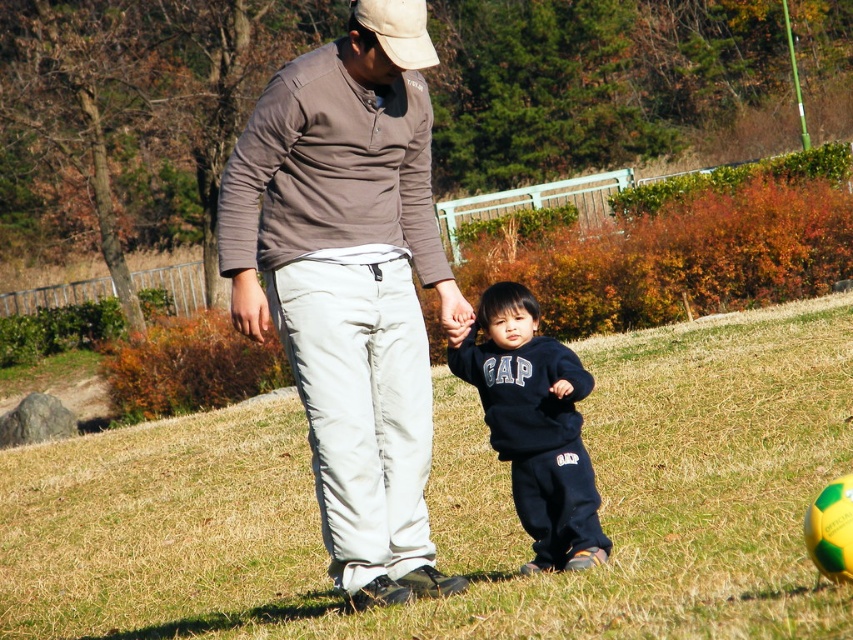
Question: Does green grass at center lie in front of white fabric baseball cap at upper center?

Choices:
 (A) yes
 (B) no

Answer: (A)

Question: Can you confirm if green grass at center is thinner than matte brown shirt at center?

Choices:
 (A) yes
 (B) no

Answer: (B)

Question: Can you confirm if matte brown shirt at center is positioned above white fabric baseball cap at upper center?

Choices:
 (A) yes
 (B) no

Answer: (B)

Question: Which point is farther to the camera?

Choices:
 (A) (596, 378)
 (B) (509, 323)
 (C) (358, 236)
 (D) (393, 13)

Answer: (A)

Question: Which object is closer to the camera taking this photo?

Choices:
 (A) matte brown shirt at center
 (B) white fabric baseball cap at upper center

Answer: (B)

Question: Considering the real-world distances, which object is farthest from the white fabric baseball cap at upper center?

Choices:
 (A) black fleece sweatshirt at center
 (B) green grass at center
 (C) matte brown shirt at center

Answer: (B)